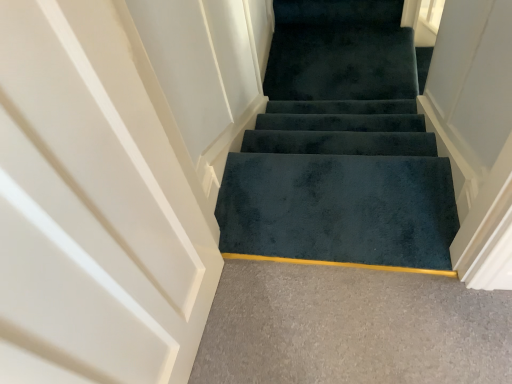
Locate an element on the screen. The width and height of the screenshot is (512, 384). dark blue carpet at center is located at coordinates (340, 143).

The image size is (512, 384). What are the coordinates of `dark blue carpet at center` in the screenshot? It's located at (340, 143).

In the scene shown: Considering the relative sizes of dark green carpet at center and dark blue carpet at center in the image provided, is dark green carpet at center bigger than dark blue carpet at center?

Correct, dark green carpet at center is larger in size than dark blue carpet at center.

Is dark green carpet at center not inside dark blue carpet at center?

dark green carpet at center is positioned outside dark blue carpet at center.

Does point (298, 252) come farther from viewer compared to point (413, 158)?

That is False.

Which of these two, dark green carpet at center or dark blue carpet at center, stands taller?

dark green carpet at center is taller.

From a real-world perspective, which is physically below, dark blue carpet at center or dark green carpet at center?

dark blue carpet at center is physically lower.

Which of these two, dark blue carpet at center or dark green carpet at center, stands shorter?

dark blue carpet at center is shorter.

Between dark blue carpet at center and dark green carpet at center, which one appears on the right side from the viewer's perspective?

From the viewer's perspective, dark blue carpet at center appears more on the right side.

Is dark blue carpet at center behind dark green carpet at center?

Yes, it is behind dark green carpet at center.

Where is `stairs below the dark blue carpet at center (from the image's perspective)`? The image size is (512, 384). stairs below the dark blue carpet at center (from the image's perspective) is located at coordinates (340, 147).

Is dark green carpet at center outside of dark blue carpet at center?

Yes, dark green carpet at center is not within dark blue carpet at center.

Between dark green carpet at center and dark blue carpet at center, which one has smaller size?

Smaller between the two is dark blue carpet at center.

Is dark blue carpet at center at the back of dark green carpet at center?

Yes, dark green carpet at center is positioned with its back facing dark blue carpet at center.

From the image's perspective, between dark blue carpet at center and dark blue carpet at center, who is located below?

dark blue carpet at center appears lower in the image.

How different are the orientations of dark blue carpet at center and dark blue carpet at center in degrees?

9.37e-05 degrees separate the facing orientations of dark blue carpet at center and dark blue carpet at center.

Is dark blue carpet at center with dark blue carpet at center?

No, dark blue carpet at center is not touching dark blue carpet at center.

Considering the sizes of objects dark blue carpet at center and dark blue carpet at center in the image provided, who is bigger, dark blue carpet at center or dark blue carpet at center?

Bigger between the two is dark blue carpet at center.

Is dark blue carpet at center oriented towards dark blue carpet at center?

No.

Looking at this image, is dark blue carpet at center shorter than dark blue carpet at center?

Yes, dark blue carpet at center is shorter than dark blue carpet at center.

How many degrees apart are the facing directions of dark blue carpet at center and dark blue carpet at center?

A: 9.37e-05 degrees separate the facing orientations of dark blue carpet at center and dark blue carpet at center.

Considering the sizes of objects dark blue carpet at center and dark green carpet at center in the image provided, who is thinner, dark blue carpet at center or dark green carpet at center?

Thinner between the two is dark green carpet at center.

From a real-world perspective, who is located higher, dark blue carpet at center or dark green carpet at center?

dark green carpet at center.

Is dark blue carpet at center oriented towards dark green carpet at center?

No, dark blue carpet at center is not oriented towards dark green carpet at center.

Between point (369, 134) and point (447, 269), which one is positioned behind?

The point (369, 134) is behind.

The image size is (512, 384). I want to click on doormat that is under the dark green carpet at center (from a real-world perspective), so click(x=339, y=208).

Image resolution: width=512 pixels, height=384 pixels. I want to click on stairs above the dark blue carpet at center (from a real-world perspective), so click(x=340, y=147).

Which object lies nearer to the anchor point dark green carpet at center, dark blue carpet at center or dark blue carpet at center?

Based on the image, dark blue carpet at center appears to be nearer to dark green carpet at center.

Considering their positions, is dark blue carpet at center positioned further to dark blue carpet at center than dark green carpet at center?

dark green carpet at center is positioned further to the anchor dark blue carpet at center.

Consider the image. From the image, which object appears to be farther from dark blue carpet at center, dark green carpet at center or dark blue carpet at center?

dark green carpet at center.

Looking at the image, which one is located further to dark blue carpet at center, dark blue carpet at center or dark green carpet at center?

dark green carpet at center is positioned further to the anchor dark blue carpet at center.

Estimate the real-world distances between objects in this image. Which object is closer to dark green carpet at center, dark blue carpet at center or dark blue carpet at center?

dark blue carpet at center.

Based on the photo, when comparing their distances from dark blue carpet at center, does dark green carpet at center or dark blue carpet at center seem closer?

dark blue carpet at center is closer to dark blue carpet at center.

The width and height of the screenshot is (512, 384). I want to click on doormat between dark green carpet at center and dark blue carpet at center from front to back, so click(x=339, y=208).